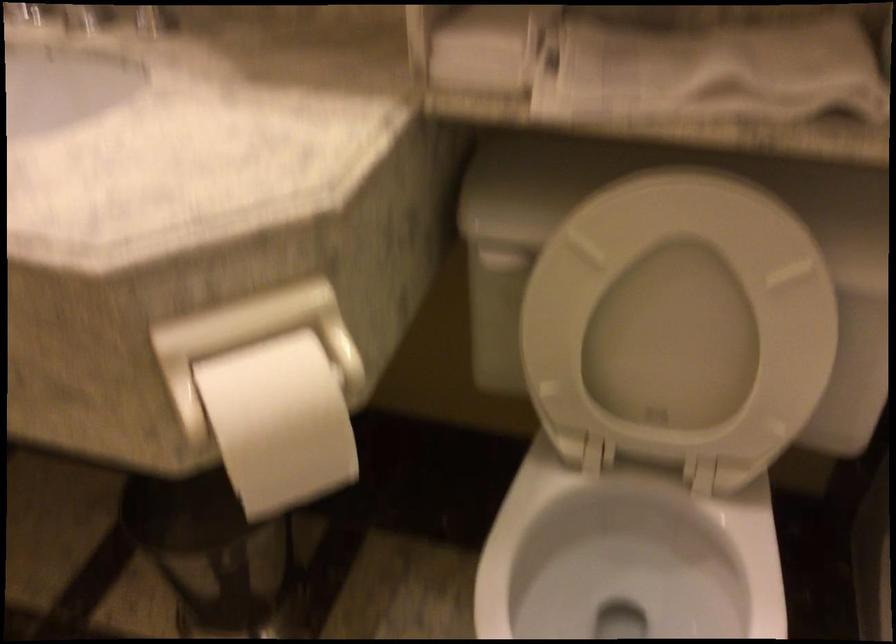
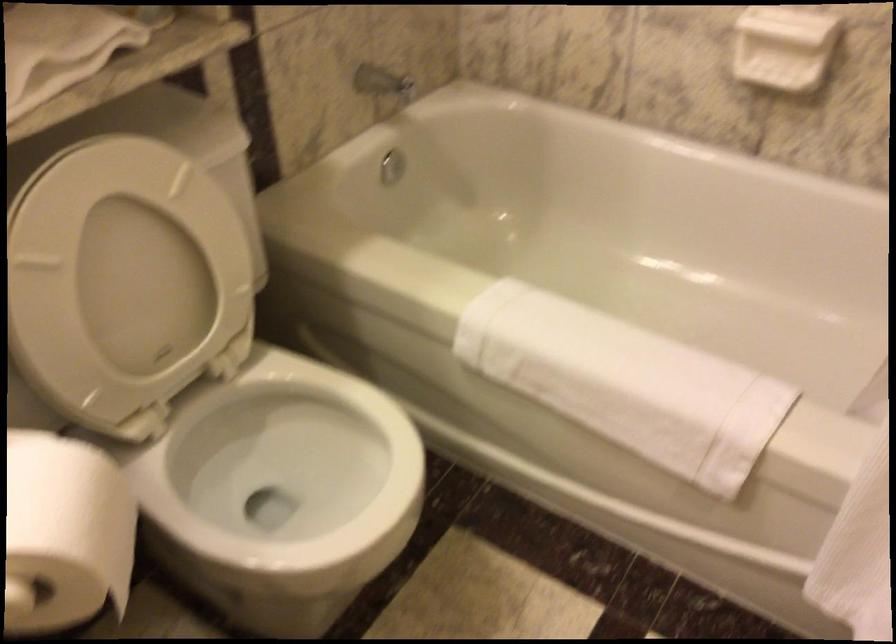
Question: I am providing you with two images of the same scene from different viewpoints. Please identify which objects are invisible in image2.

Choices:
 (A) white soap dish
 (B) white toilet paper
 (C) white folded towel
 (D) none of these

Answer: (D)